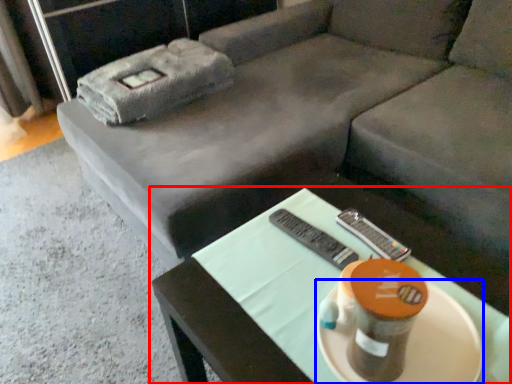
Question: Among these objects, which one is farthest to the camera, table (highlighted by a red box) or platter (highlighted by a blue box)?

Choices:
 (A) table
 (B) platter

Answer: (B)